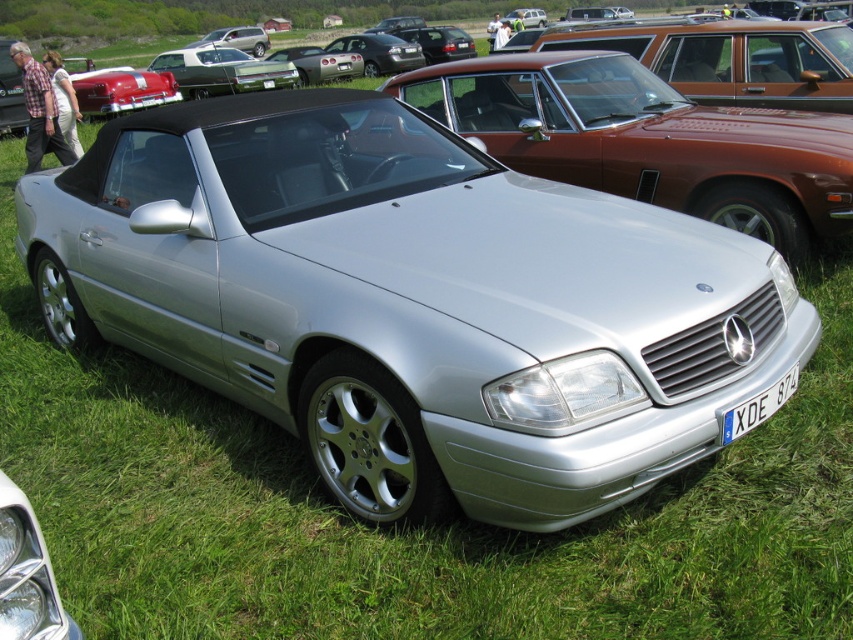
You are a photographer trying to capture the silver metallic convertible at center and the matte brown station wagon at upper center in your shot. Since you want the convertible to be the main focus, which vehicle should you position closer to the camera?

The silver metallic convertible at center is already closer to the viewer than the matte brown station wagon at upper center, so positioning the camera as is would make the convertible the main focus.